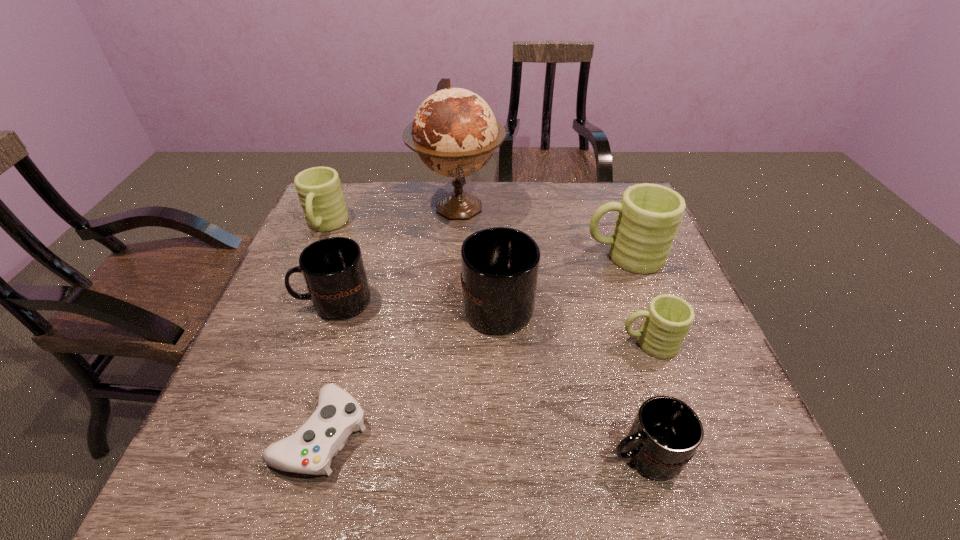
The width and height of the screenshot is (960, 540). Identify the location of mug that is the fourth nearest to the fourth mug from right to left. (666, 432).

Identify which green mug is located as the nearest to the second biggest green mug. Please provide its 2D coordinates. Your answer should be formatted as a tuple, i.e. [(x, y)], where the tuple contains the x and y coordinates of a point satisfying the conditions above.

[(649, 215)]

The image size is (960, 540). I want to click on green mug object that ranks as the second closest to the white control, so click(668, 318).

Find the location of a particular element. This screenshot has width=960, height=540. the third closest black mug to the nearest green mug is located at coordinates (333, 269).

Where is `black mug object that ranks as the third closest to the control`? The image size is (960, 540). black mug object that ranks as the third closest to the control is located at coordinates (666, 432).

Where is `vacant area that satisfies the following two spatial constraints: 1. with the handle on the side of the fourth mug from right to left; 2. with the handle on the side of the leftmost black mug`? The height and width of the screenshot is (540, 960). vacant area that satisfies the following two spatial constraints: 1. with the handle on the side of the fourth mug from right to left; 2. with the handle on the side of the leftmost black mug is located at coordinates point(497,301).

In order to click on free spot that satisfies the following two spatial constraints: 1. on the side of the leftmost green mug with the handle; 2. on the right side of the control in this screenshot , I will do `click(237, 434)`.

This screenshot has height=540, width=960. I want to click on free space that satisfies the following two spatial constraints: 1. with the handle on the side of the second biggest black mug; 2. on the left side of the white control, so click(x=290, y=434).